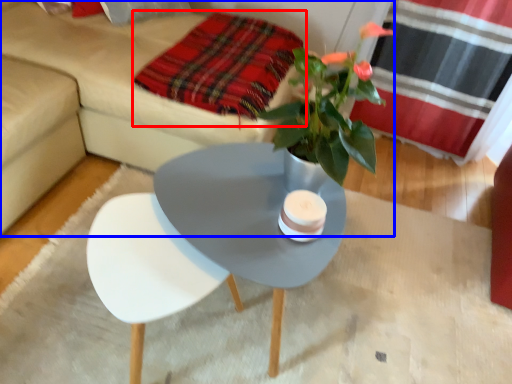
Question: Which object is closer to the camera taking this photo, blanket (highlighted by a red box) or studio couch (highlighted by a blue box)?

Choices:
 (A) blanket
 (B) studio couch

Answer: (B)